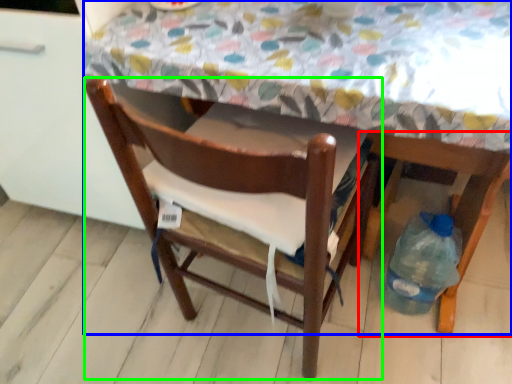
Question: Based on their relative distances, which object is farther from chair (highlighted by a red box)? Choose from table (highlighted by a blue box) and chair (highlighted by a green box).

Choices:
 (A) table
 (B) chair

Answer: (A)